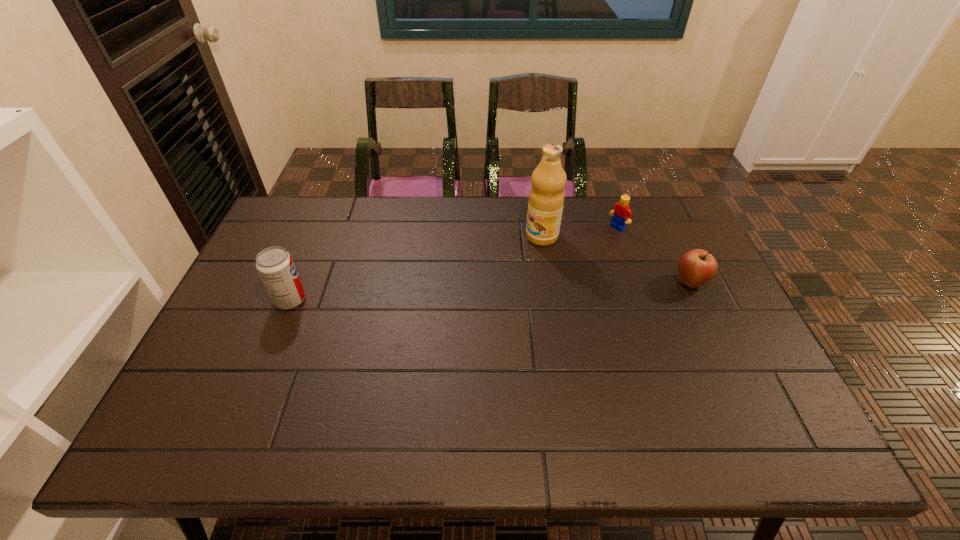
Where is `free spot between the apple and the Lego`? The height and width of the screenshot is (540, 960). free spot between the apple and the Lego is located at coordinates (654, 255).

Where is `free space between the leftmost object and the Lego`? This screenshot has height=540, width=960. free space between the leftmost object and the Lego is located at coordinates (454, 264).

Locate an element on the screen. This screenshot has width=960, height=540. object that is the closest to the third shortest object is located at coordinates (546, 198).

Image resolution: width=960 pixels, height=540 pixels. I want to click on the closest object to the third object from left to right, so click(x=546, y=198).

Locate an element on the screen. This screenshot has height=540, width=960. vacant position in the image that satisfies the following two spatial constraints: 1. on the back side of the Lego; 2. on the right side of the leftmost object is located at coordinates (320, 227).